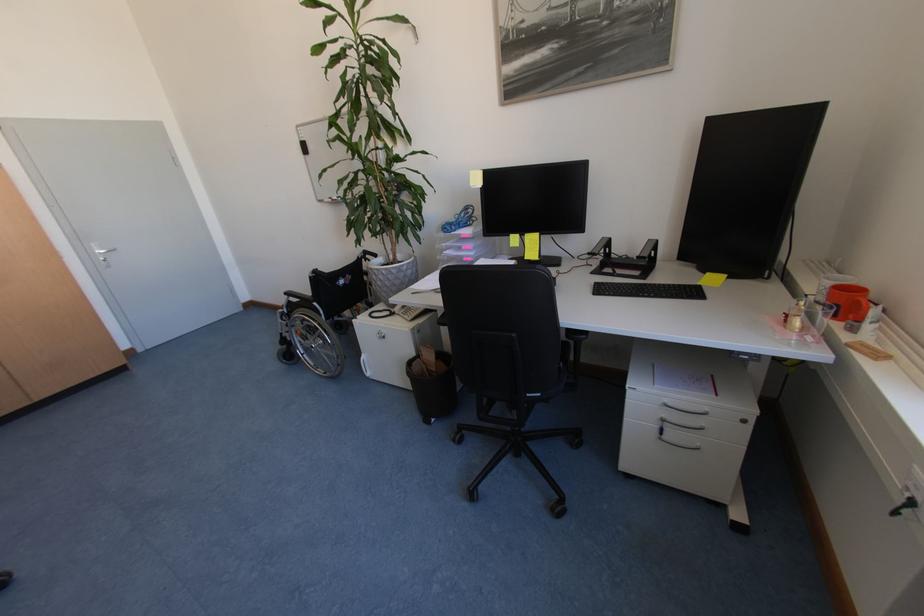
The image size is (924, 616). What do you see at coordinates (314, 342) in the screenshot?
I see `the wheelchair wheel` at bounding box center [314, 342].